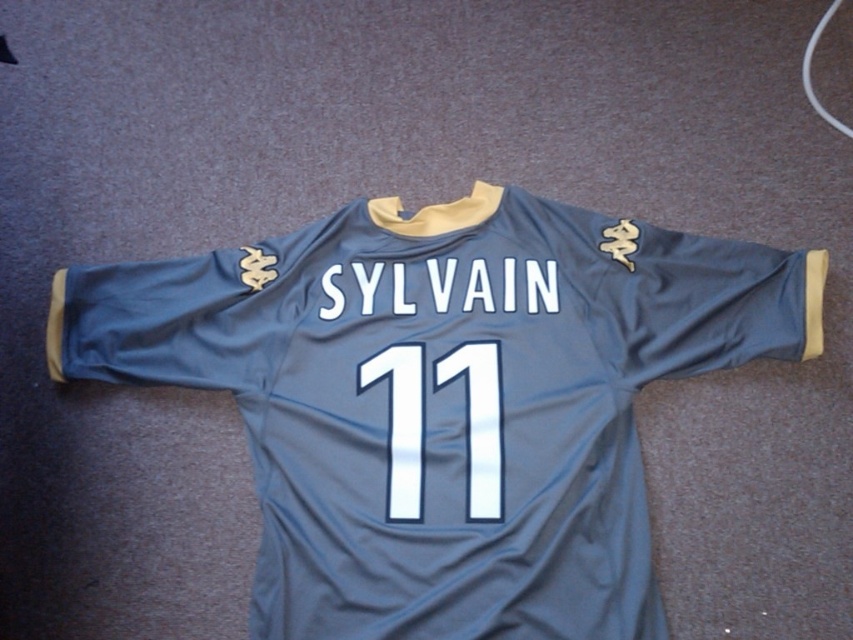
Is matte gray jersey at center above white glossy number at center?

Indeed, matte gray jersey at center is positioned over white glossy number at center.

What do you see at coordinates (445, 401) in the screenshot? This screenshot has height=640, width=853. I see `matte gray jersey at center` at bounding box center [445, 401].

At what (x,y) coordinates should I click in order to perform the action: click on matte gray jersey at center. Please return your answer as a coordinate pair (x, y). The height and width of the screenshot is (640, 853). Looking at the image, I should click on (445, 401).